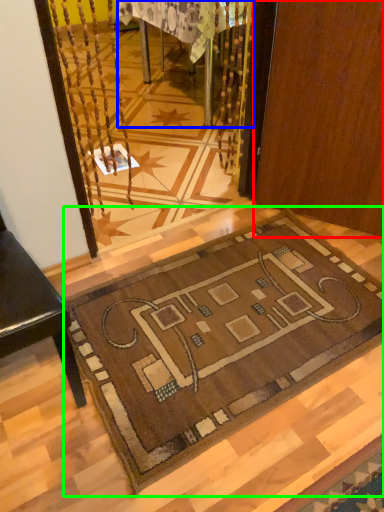
Question: Which is farther away from door (highlighted by a red box)? table (highlighted by a blue box) or mat (highlighted by a green box)?

Choices:
 (A) table
 (B) mat

Answer: (A)